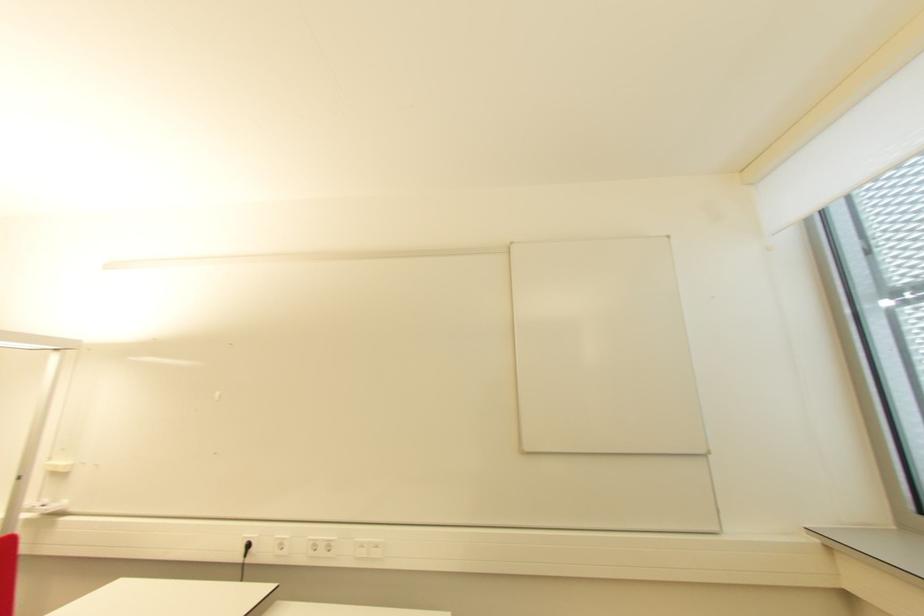
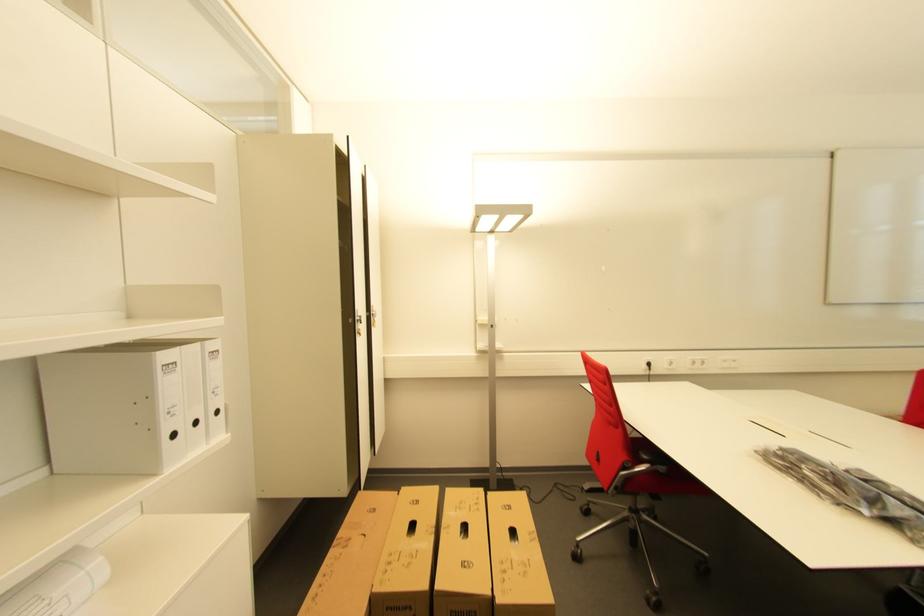
Question: Which direction would the cameraman need to move to produce the second image? Reply with the corresponding letter.

Choices:
 (A) Left
 (B) Right
 (C) Forward
 (D) Backward

Answer: (A)